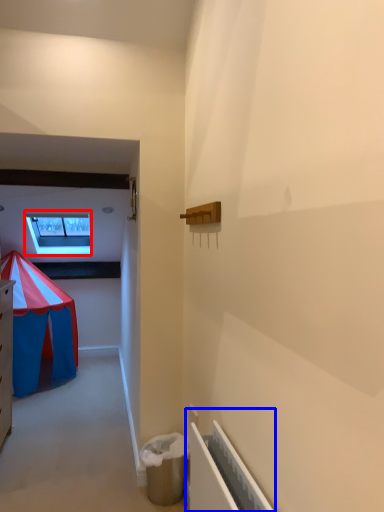
Question: Which point is closer to the camera, window (highlighted by a red box) or radiator (highlighted by a blue box)?

Choices:
 (A) window
 (B) radiator

Answer: (B)